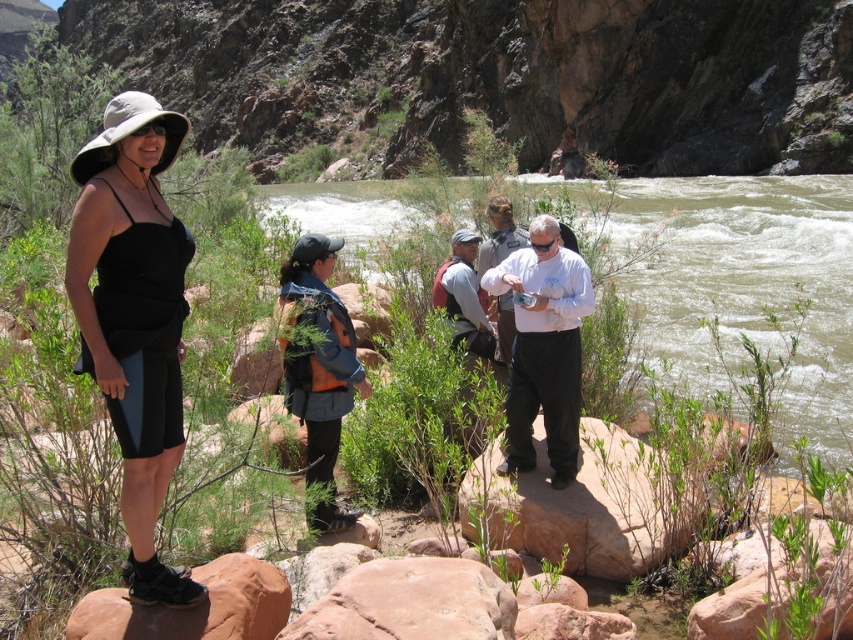
Between matte black dress at center and camouflage fabric backpack at center, which one has less height?

camouflage fabric backpack at center

Is point (161, 582) behind point (467, 326)?

No, (161, 582) is in front of (467, 326).

Locate an element on the screen. matte black dress at center is located at coordinates (134, 316).

Which is above, reddish-brown rock at center-right or blue fabric backpack at center?

blue fabric backpack at center

Who is positioned more to the left, reddish-brown rock at center-right or blue fabric backpack at center?

From the viewer's perspective, blue fabric backpack at center appears more on the left side.

Between point (602, 536) and point (322, 524), which one is positioned behind?

Point (322, 524)

I want to click on reddish-brown rock at center-right, so click(579, 506).

Does point (247, 573) lie behind point (474, 320)?

No.

Is reddish-brown rock at lower left thinner than camouflage fabric backpack at center?

Indeed, reddish-brown rock at lower left has a lesser width compared to camouflage fabric backpack at center.

Measure the distance between point (227, 609) and camera.

They are 25.08 meters apart.

Locate an element on the screen. The image size is (853, 640). reddish-brown rock at lower left is located at coordinates (193, 605).